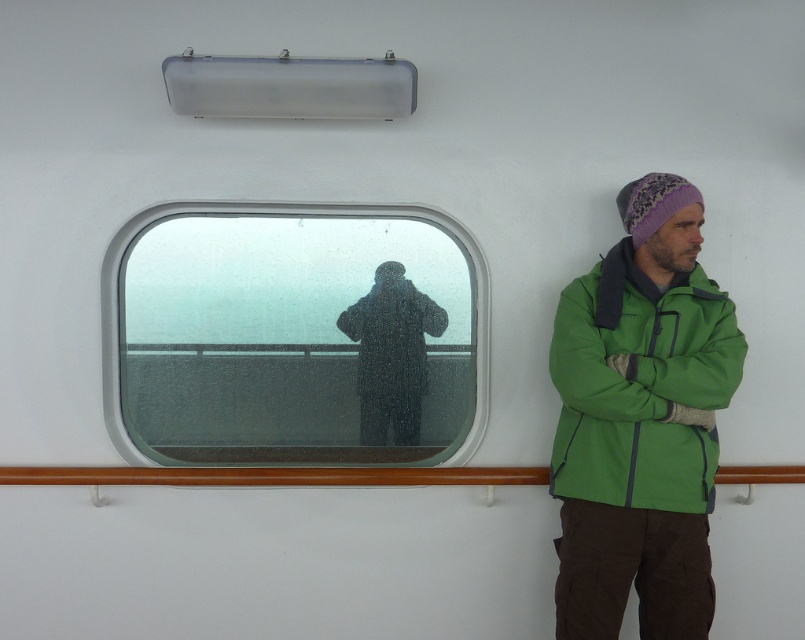
Question: Is clear glass window at center wider than green softshell jacket at right?

Choices:
 (A) no
 (B) yes

Answer: (B)

Question: Which object is positioned farthest from the brown wood rail at center?

Choices:
 (A) clear glass window at center
 (B) green softshell jacket at right

Answer: (B)

Question: Which is nearer to the clear glass window at center?

Choices:
 (A) brown wood rail at center
 (B) dark matte coat at center
 (C) green softshell jacket at right

Answer: (B)

Question: Estimate the real-world distances between objects in this image. Which object is farther from the clear glass window at center?

Choices:
 (A) brown wood rail at center
 (B) dark matte coat at center
 (C) green softshell jacket at right

Answer: (C)

Question: Can you confirm if brown wood rail at center is bigger than dark matte coat at center?

Choices:
 (A) no
 (B) yes

Answer: (B)

Question: Is clear glass window at center thinner than dark matte coat at center?

Choices:
 (A) no
 (B) yes

Answer: (A)